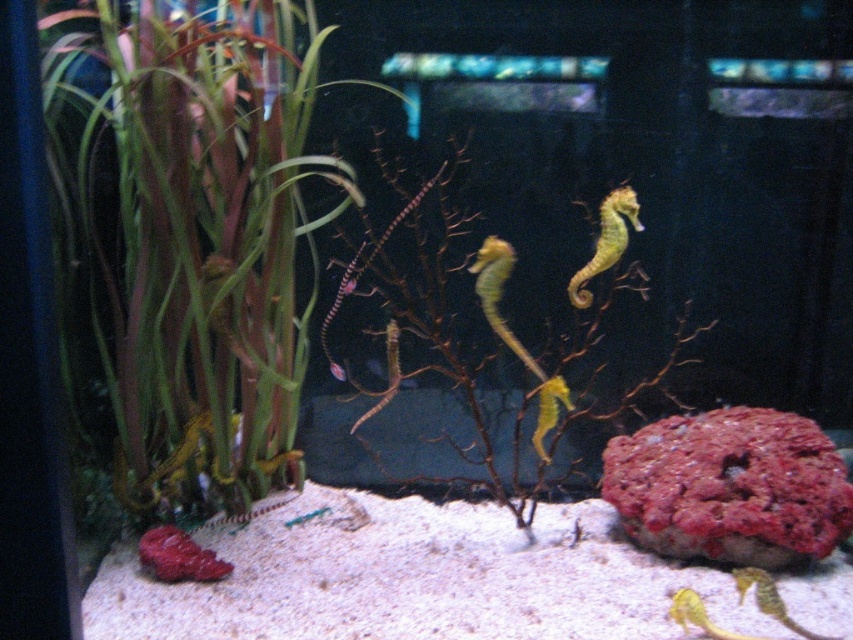
You are an underwater photographer aiming to capture both the point at (212, 356) and the point at (502, 252) in the aquarium. Which point should you focus on first to ensure both are in focus?

You should focus on point (212, 356) first because it is closer to the camera than point (502, 252), ensuring both are within the depth of field.

You are an aquarium maintenance worker checking the tank. You notice two seahorses, the yellow matte seahorse at center and the smooth yellow seahorse at center. Which one has a wider body?

The yellow matte seahorse at center might be wider than smooth yellow seahorse at center.

You are an underwater photographer aiming to capture a photo of the yellow matte seahorse at center. To do this, you need to position yourself so that the green matte plant at left is partially blocking the seahorse. Given their sizes, is this possible?

The green matte plant at left is much taller than the yellow matte seahorse at center, so yes, positioning yourself so that the green matte plant at left partially blocks the yellow matte seahorse at center is possible due to its greater height.